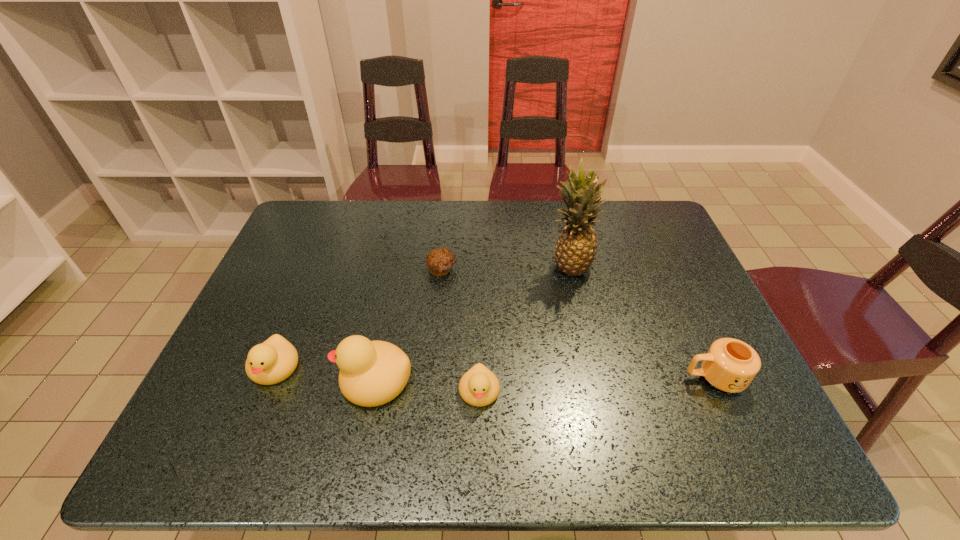
At what (x,y) coordinates should I click in order to perform the action: click on vacant point located between the muffin and the rightmost object. Please return your answer as a coordinate pair (x, y). Image resolution: width=960 pixels, height=540 pixels. Looking at the image, I should click on (578, 324).

Where is `blank region between the shortest object and the second object from right to left`? Image resolution: width=960 pixels, height=540 pixels. blank region between the shortest object and the second object from right to left is located at coordinates (505, 268).

Identify the location of vacant space that's between the leftmost duckling and the second tallest object. (324, 373).

Locate an element on the screen. free spot between the muffin and the second object from right to left is located at coordinates (505, 268).

The image size is (960, 540). Find the location of `empty location between the mug and the tallest object`. empty location between the mug and the tallest object is located at coordinates (641, 322).

Locate which object ranks third in proximity to the rightmost object. Please provide its 2D coordinates. Your answer should be formatted as a tuple, i.e. [(x, y)], where the tuple contains the x and y coordinates of a point satisfying the conditions above.

[(440, 261)]

Identify the location of object that is the fifth nearest to the leftmost duckling. The image size is (960, 540). (730, 365).

Identify the location of duckling that stands as the closest to the tallest object. (479, 386).

Locate which duckling ranks in proximity to the rightmost object. Please provide its 2D coordinates. Your answer should be formatted as a tuple, i.e. [(x, y)], where the tuple contains the x and y coordinates of a point satisfying the conditions above.

[(479, 386)]

Identify the location of free spot that satisfies the following two spatial constraints: 1. on the handle side of the rightmost object; 2. on the face of the shortest duckling. The height and width of the screenshot is (540, 960). (720, 392).